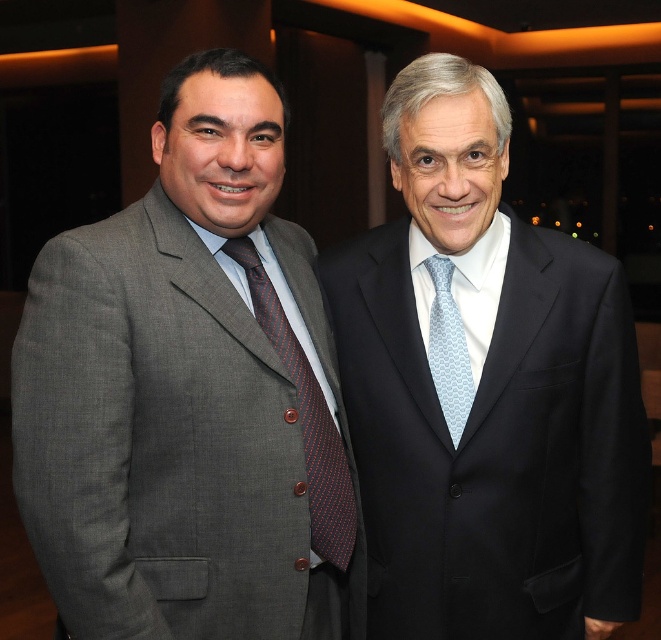
Question: Which object is farther from the camera taking this photo?

Choices:
 (A) gray textured suit at left
 (B) matte black suit at right
 (C) light blue textured tie at center

Answer: (C)

Question: Among these objects, which one is nearest to the camera?

Choices:
 (A) light blue textured tie at center
 (B) matte black suit at right
 (C) gray textured suit at left
 (D) red dotted tie at center

Answer: (C)

Question: Which point is farther from the camera taking this photo?

Choices:
 (A) (325, 467)
 (B) (455, 310)
 (C) (520, 614)
 (D) (19, 490)

Answer: (B)

Question: Can you confirm if matte black suit at right is positioned above light blue textured tie at center?

Choices:
 (A) yes
 (B) no

Answer: (B)

Question: Is matte black suit at right wider than red dotted tie at center?

Choices:
 (A) yes
 (B) no

Answer: (A)

Question: Is matte black suit at right closer to the viewer compared to light blue textured tie at center?

Choices:
 (A) no
 (B) yes

Answer: (B)